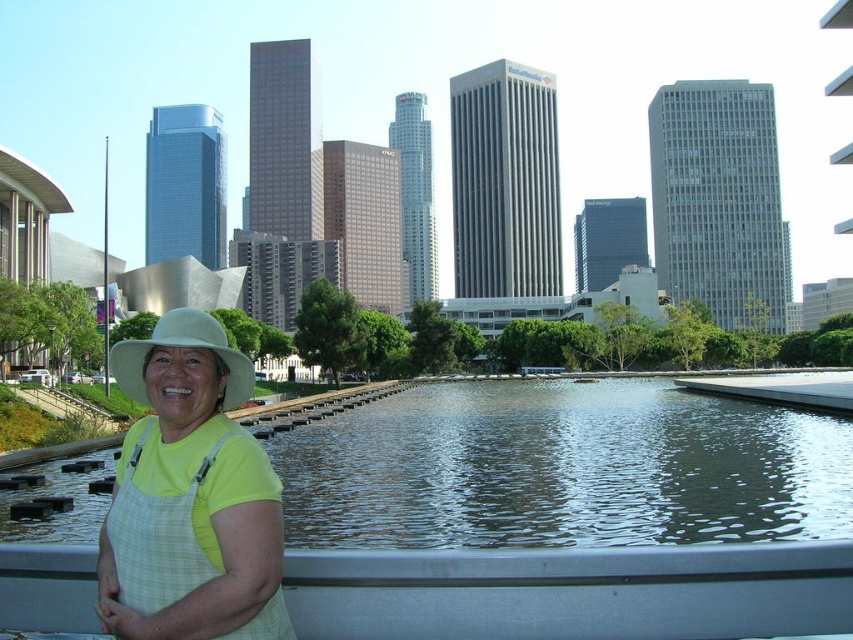
Question: Which object is closer to the camera taking this photo?

Choices:
 (A) clear water at center
 (B) white matte hat at lower left
 (C) yellow-green fabric apron at lower left

Answer: (C)

Question: Is clear water at center thinner than white matte hat at lower left?

Choices:
 (A) no
 (B) yes

Answer: (A)

Question: Which point is closer to the camera?

Choices:
 (A) clear water at center
 (B) yellow-green fabric apron at lower left

Answer: (B)

Question: Which of these objects is positioned closest to the yellow-green fabric apron at lower left?

Choices:
 (A) clear water at center
 (B) white matte hat at lower left

Answer: (B)

Question: Considering the relative positions of yellow-green fabric apron at lower left and white matte hat at lower left in the image provided, where is yellow-green fabric apron at lower left located with respect to white matte hat at lower left?

Choices:
 (A) left
 (B) right

Answer: (B)

Question: Can you confirm if yellow-green fabric apron at lower left is smaller than white matte hat at lower left?

Choices:
 (A) no
 (B) yes

Answer: (B)